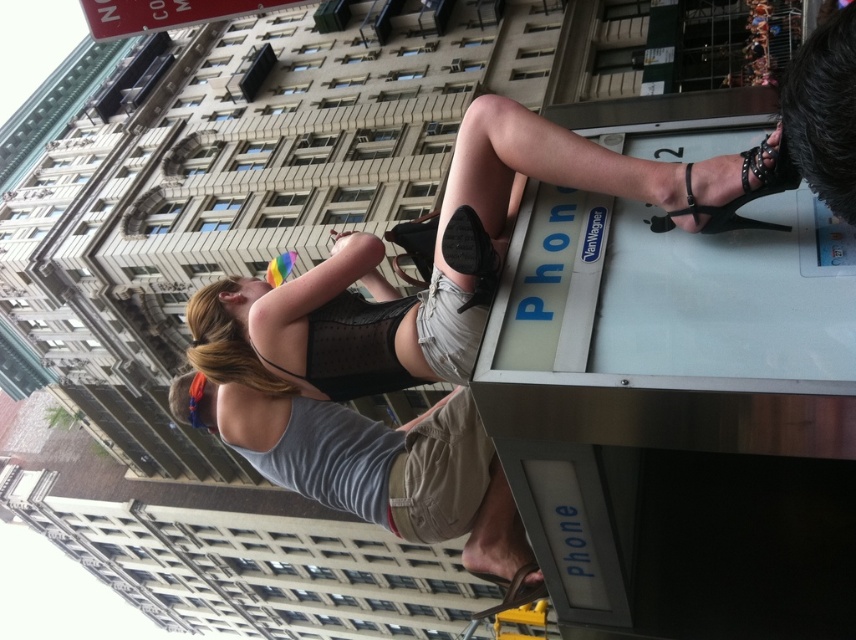
Question: Can you confirm if black leather sandal at upper right is positioned to the right of brown leather sandal at lower center?

Choices:
 (A) no
 (B) yes

Answer: (B)

Question: Which point is closer to the camera?

Choices:
 (A) brown leather sandal at lower center
 (B) matte black high-heeled shoe at upper right

Answer: (B)

Question: Which of these objects is positioned closest to the matte black high-heeled shoe at upper right?

Choices:
 (A) black leather sandal at upper right
 (B) brown leather sandal at lower center

Answer: (A)

Question: Can you confirm if matte black high-heeled shoe at upper right is positioned to the right of black leather sandal at upper right?

Choices:
 (A) no
 (B) yes

Answer: (A)

Question: Among these objects, which one is nearest to the camera?

Choices:
 (A) black leather sandal at upper right
 (B) brown leather sandal at lower center
 (C) matte black high-heeled shoe at upper right

Answer: (A)

Question: Does matte black high-heeled shoe at upper right appear over black leather sandal at upper right?

Choices:
 (A) no
 (B) yes

Answer: (A)